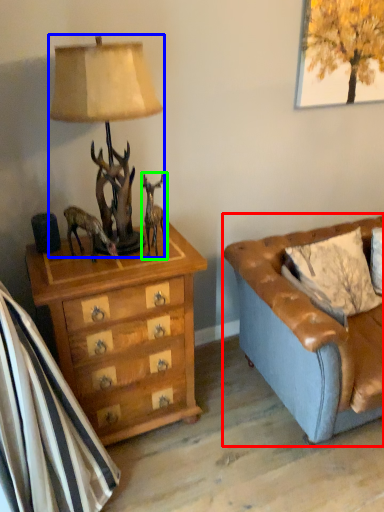
Question: Estimate the real-world distances between objects in this image. Which object is farther from studio couch (highlighted by a red box), lamp (highlighted by a blue box) or reindeer (highlighted by a green box)?

Choices:
 (A) lamp
 (B) reindeer

Answer: (A)